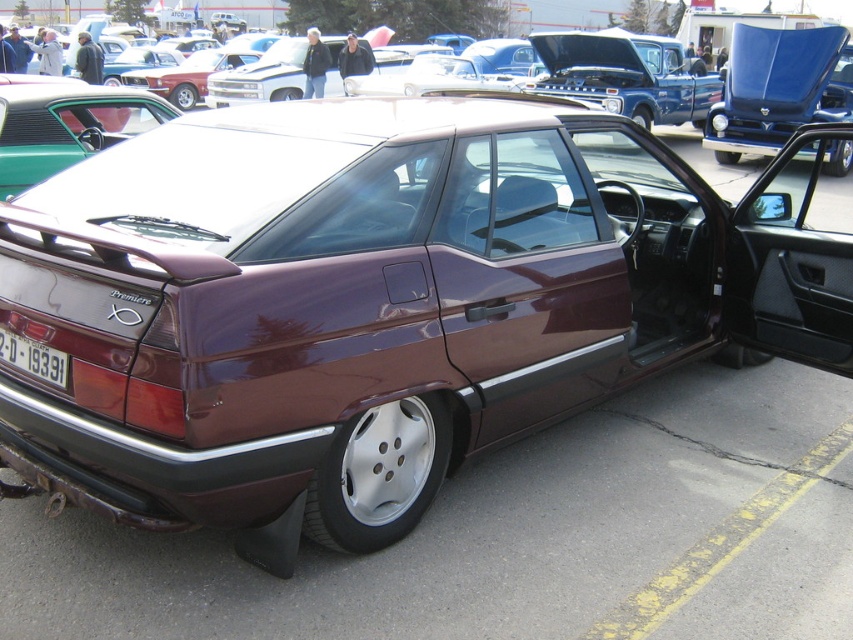
Between shiny blue hood at upper right and satin burgundy sedan at center, which one is positioned lower?

shiny blue hood at upper right

Describe the element at coordinates (776, 88) in the screenshot. Image resolution: width=853 pixels, height=640 pixels. I see `shiny blue hood at upper right` at that location.

Find the location of `shiny blue hood at upper right`. shiny blue hood at upper right is located at coordinates 776,88.

Who is more forward, (619,49) or (39,365)?

Point (39,365)

Is satin burgundy sedan at center positioned in front of white plastic license plate at rear?

No, satin burgundy sedan at center is behind white plastic license plate at rear.

Between point (579, 84) and point (1, 330), which one is positioned in front?

Point (1, 330) is more forward.

Locate an element on the screen. The width and height of the screenshot is (853, 640). satin burgundy sedan at center is located at coordinates [625, 74].

Consider the image. Is shiny blue hood at upper right closer to camera compared to white plastic license plate at rear?

That is False.

Which is in front, point (744, 49) or point (41, 342)?

Positioned in front is point (41, 342).

Is point (752, 81) farther from viewer compared to point (59, 369)?

Yes, it is behind point (59, 369).

This screenshot has height=640, width=853. In order to click on shiny blue hood at upper right in this screenshot , I will do `click(776, 88)`.